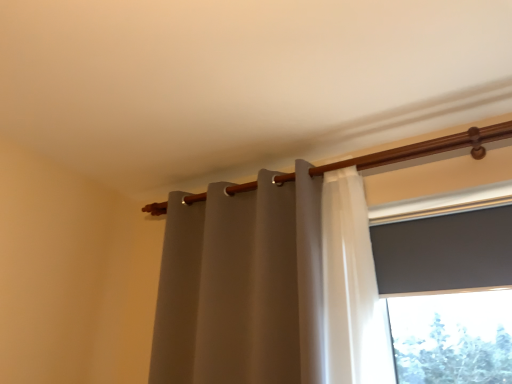
Question: Is wooden curtain rod at upper center shorter than matte gray screen at upper right?

Choices:
 (A) yes
 (B) no

Answer: (A)

Question: From a real-world perspective, is wooden curtain rod at upper center positioned under matte gray screen at upper right based on gravity?

Choices:
 (A) no
 (B) yes

Answer: (A)

Question: Considering the relative sizes of wooden curtain rod at upper center and matte gray screen at upper right in the image provided, is wooden curtain rod at upper center thinner than matte gray screen at upper right?

Choices:
 (A) no
 (B) yes

Answer: (A)

Question: Is wooden curtain rod at upper center positioned in front of matte gray screen at upper right?

Choices:
 (A) no
 (B) yes

Answer: (A)

Question: Considering the relative positions of wooden curtain rod at upper center and matte gray screen at upper right in the image provided, is wooden curtain rod at upper center to the left of matte gray screen at upper right from the viewer's perspective?

Choices:
 (A) no
 (B) yes

Answer: (B)

Question: In terms of size, does matte gray curtain at center appear bigger or smaller than wooden curtain rod at upper center?

Choices:
 (A) big
 (B) small

Answer: (A)

Question: Is matte gray curtain at center in front of or behind wooden curtain rod at upper center in the image?

Choices:
 (A) behind
 (B) front

Answer: (B)

Question: From their relative heights in the image, would you say matte gray curtain at center is taller or shorter than wooden curtain rod at upper center?

Choices:
 (A) tall
 (B) short

Answer: (A)

Question: From the image's perspective, is matte gray curtain at center above or below wooden curtain rod at upper center?

Choices:
 (A) above
 (B) below

Answer: (B)

Question: In the image, is matte gray curtain at center positioned in front of or behind matte gray screen at upper right?

Choices:
 (A) behind
 (B) front

Answer: (B)

Question: From a real-world perspective, relative to matte gray screen at upper right, is matte gray curtain at center vertically above or below?

Choices:
 (A) below
 (B) above

Answer: (A)

Question: In terms of width, does matte gray curtain at center look wider or thinner when compared to matte gray screen at upper right?

Choices:
 (A) wide
 (B) thin

Answer: (A)

Question: From the image's perspective, relative to matte gray screen at upper right, is matte gray curtain at center above or below?

Choices:
 (A) below
 (B) above

Answer: (A)

Question: Would you say matte gray screen at upper right is to the left or to the right of matte gray curtain at center in the picture?

Choices:
 (A) left
 (B) right

Answer: (B)

Question: From a real-world perspective, is matte gray screen at upper right positioned above or below matte gray curtain at center?

Choices:
 (A) below
 (B) above

Answer: (B)